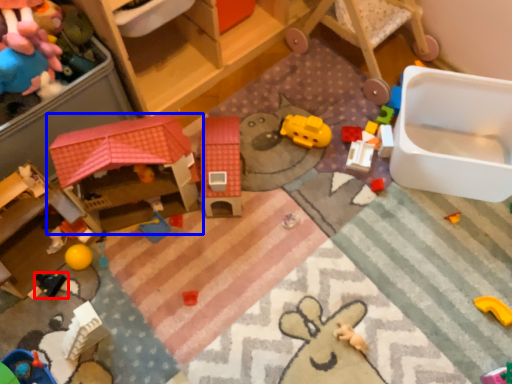
Question: Which of the following is the closest to the observer, toy (highlighted by a red box) or toy (highlighted by a blue box)?

Choices:
 (A) toy
 (B) toy

Answer: (B)